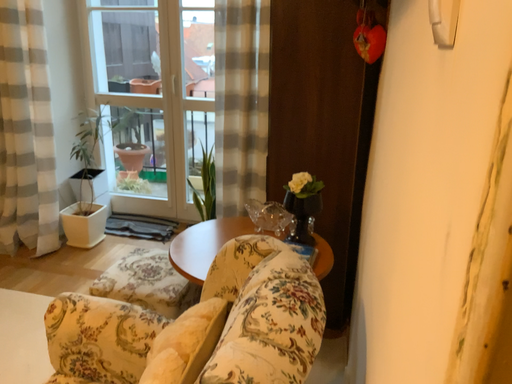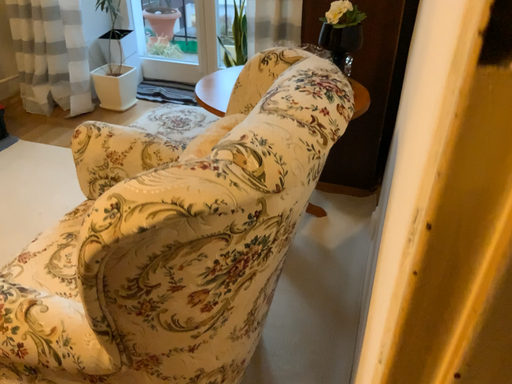
Question: Which way did the camera rotate in the video?

Choices:
 (A) rotated downward
 (B) rotated upward

Answer: (A)